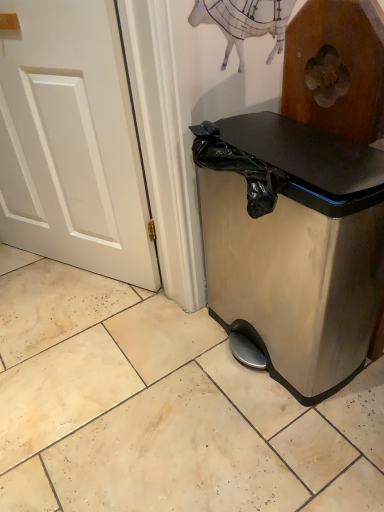
The width and height of the screenshot is (384, 512). I want to click on vacant space in front of satin silver trash can at lower right, so click(274, 446).